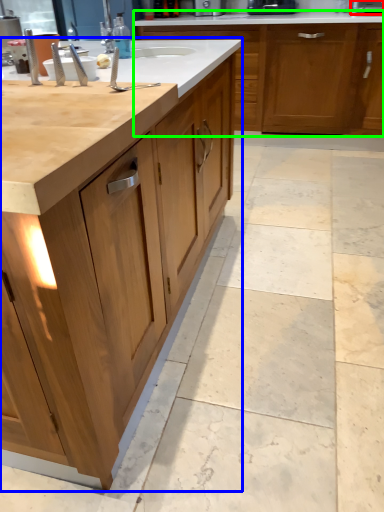
Question: Based on their relative distances, which object is nearer to appliance (highlighted by a red box)? Choose from cabinetry (highlighted by a blue box) and cabinetry (highlighted by a green box).

Choices:
 (A) cabinetry
 (B) cabinetry

Answer: (B)